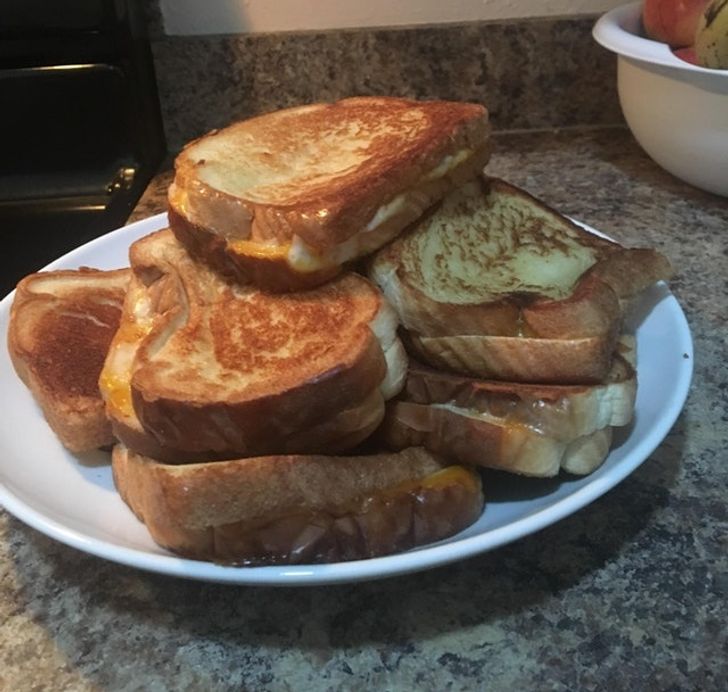
Image resolution: width=728 pixels, height=692 pixels. Identify the location of counter. (613, 585).